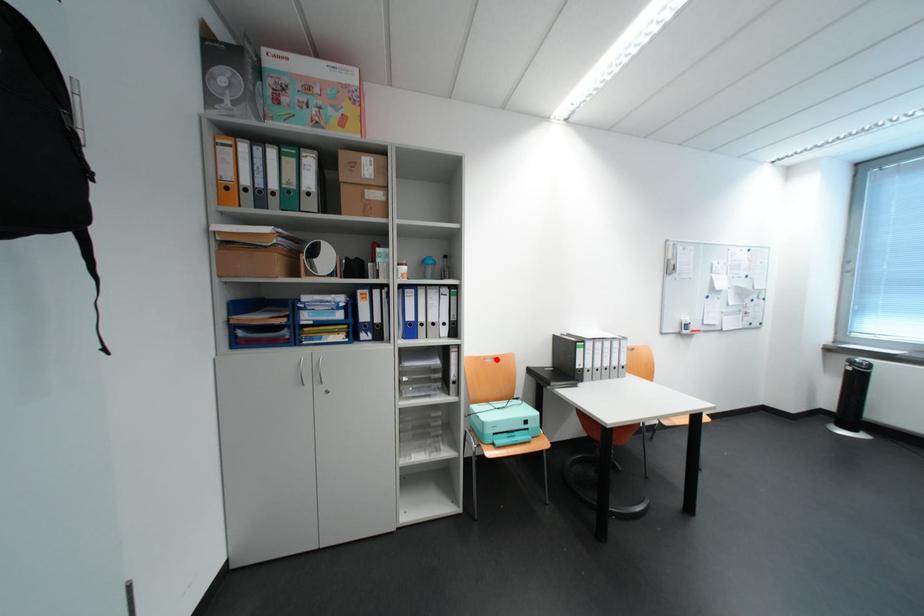
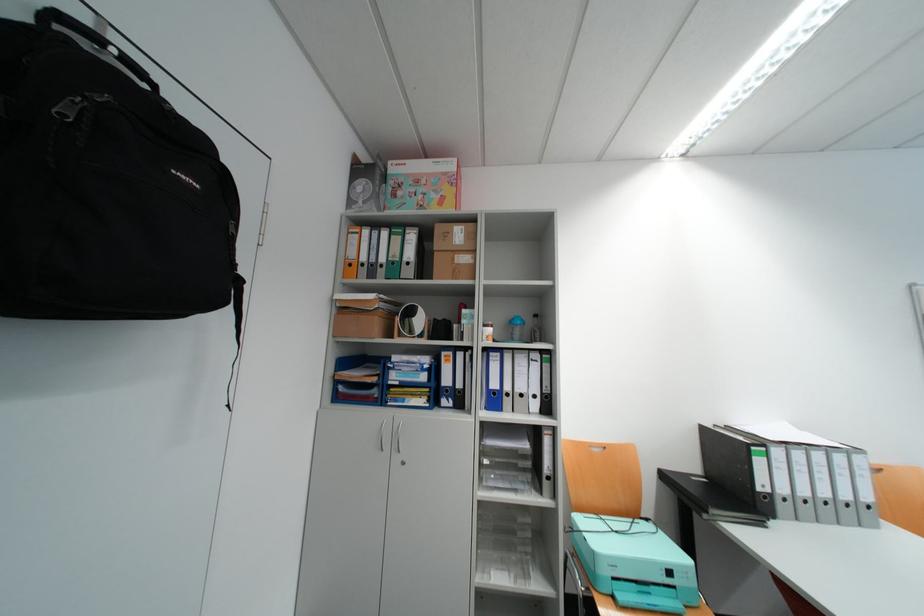
Where in the second image is the point corresponding to the highlighted location from the first image?

(602, 447)